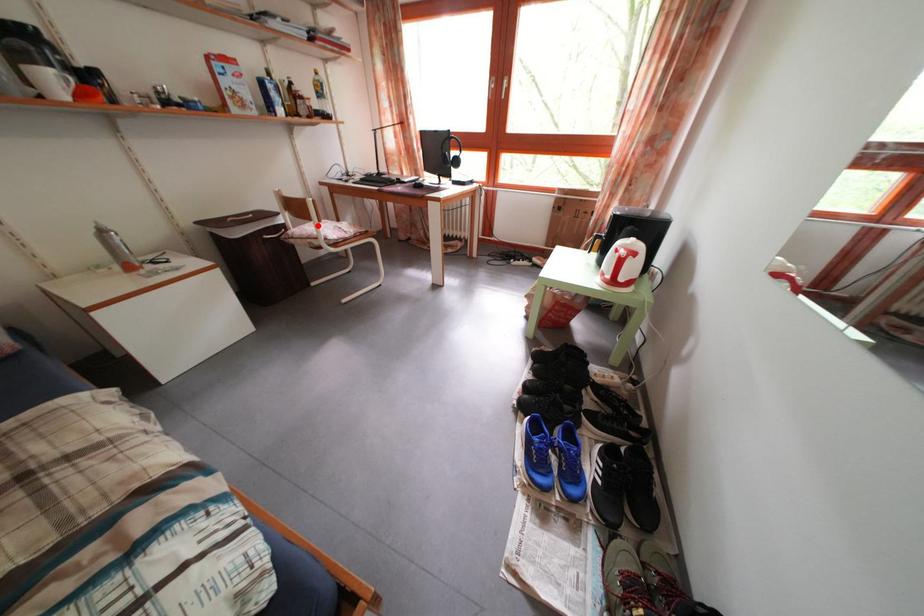
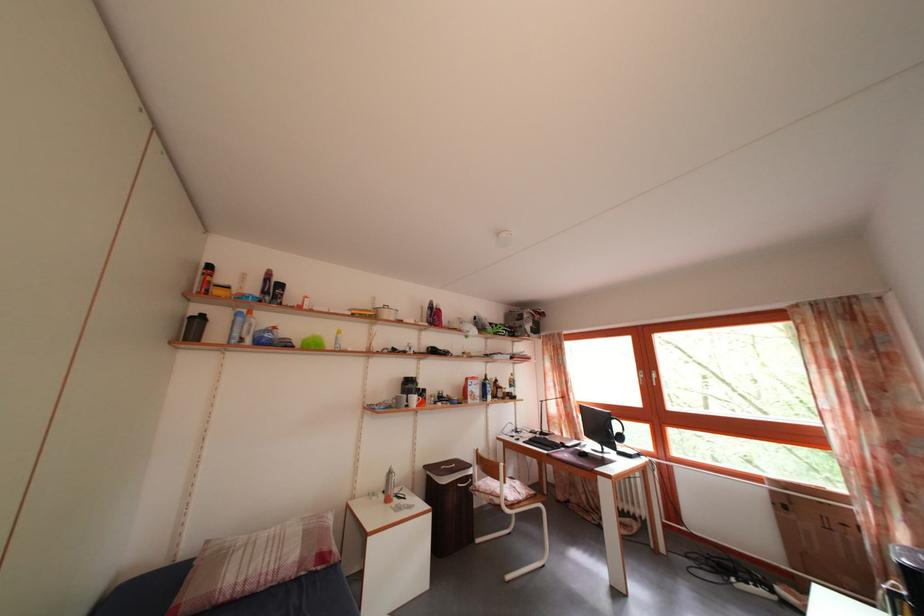
Find the pixel in the second image that matches the highlighted location in the first image.

(505, 485)